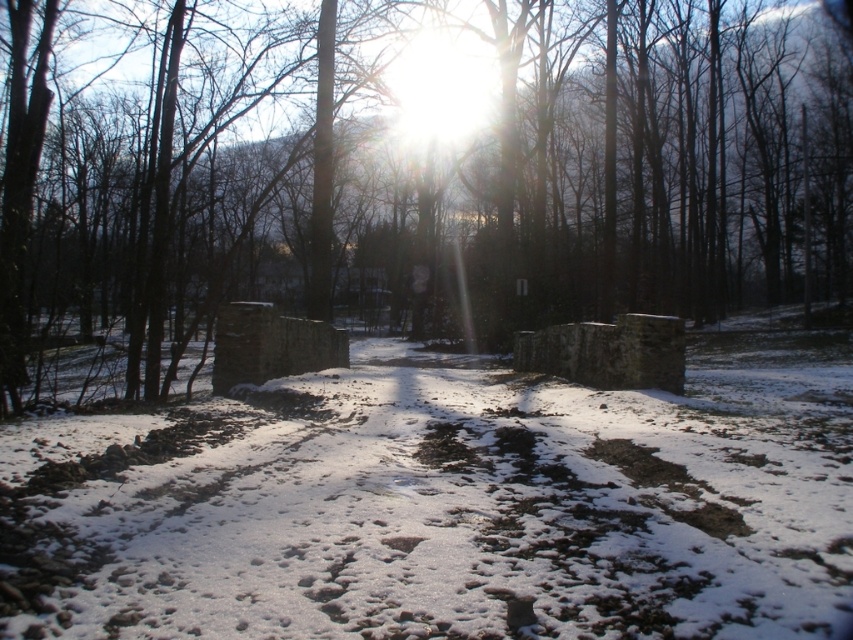
You are planning to build a small snowman using the white powdery snow at center. Considering the size of the brown wood tree at center, will there be enough snow available to make a snowman that is half the height of the tree?

The brown wood tree at center is larger in size than the white powdery snow at center. Since the snow is smaller in size, there may not be enough snow to make a snowman that is half the height of the tree.

You are a photographer trying to capture both point [194,189] and point [36,452] in the same frame. Since you can only focus on one point at a time, which point should you focus on to ensure the other is still in acceptable focus range?

You should focus on point [194,189] because it is closer to the camera than point [36,452]. By focusing on the closer point, the depth of field will extend further back, potentially keeping both points in acceptable focus.